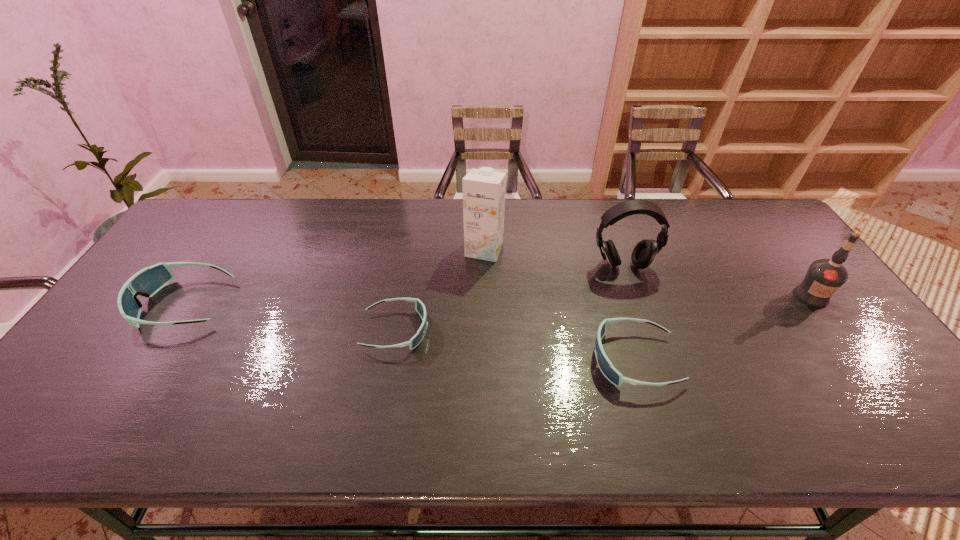
Locate an element on the screen. The image size is (960, 540). blank space located 0.200m on the front-facing side of the second tallest goggles is located at coordinates (512, 360).

Identify the location of free space located on the front-facing side of the second tallest goggles. The height and width of the screenshot is (540, 960). (471, 360).

Identify the location of vacant space located on the front-facing side of the second tallest goggles. (440, 360).

The height and width of the screenshot is (540, 960). What are the coordinates of `blank area located 0.260m on the front label of the vodka` in the screenshot? It's located at (881, 390).

The height and width of the screenshot is (540, 960). In order to click on free region located on the right of the third object from left to right in this screenshot , I will do `click(522, 249)`.

Find the location of a particular element. free point located on the ear cups of the earphone is located at coordinates (667, 394).

Identify the location of object that is at the far edge. This screenshot has height=540, width=960. (484, 189).

You are a GUI agent. You are given a task and a screenshot of the screen. Output one action in this format:
    pyautogui.click(x=<x>, y=<y>)
    Task: Click on the object positioned at the near edge
    This screenshot has height=540, width=960.
    Given the screenshot: What is the action you would take?
    pyautogui.click(x=609, y=371)

You are a GUI agent. You are given a task and a screenshot of the screen. Output one action in this format:
    pyautogui.click(x=<x>, y=<y>)
    Task: Click on the object that is at the left edge
    This screenshot has height=540, width=960.
    Given the screenshot: What is the action you would take?
    pyautogui.click(x=147, y=282)

Where is `object at the right edge`? The width and height of the screenshot is (960, 540). object at the right edge is located at coordinates (824, 277).